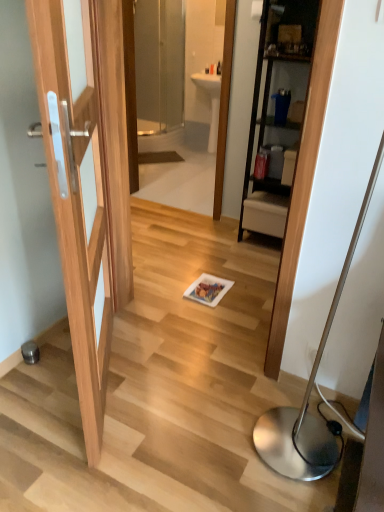
Question: Is silver metallic floor lamp at lower right taller or shorter than transparent glass mirror at upper center?

Choices:
 (A) tall
 (B) short

Answer: (B)

Question: From the image's perspective, relative to transparent glass mirror at upper center, is silver metallic floor lamp at lower right above or below?

Choices:
 (A) below
 (B) above

Answer: (A)

Question: Considering the real-world distances, which object is farthest from the silver metallic floor lamp at lower right?

Choices:
 (A) transparent glass mirror at upper center
 (B) white glossy sink at center
 (C) transparent glass screen door at upper center

Answer: (C)

Question: Based on their relative distances, which object is farther from the transparent glass screen door at upper center?

Choices:
 (A) silver metallic floor lamp at lower right
 (B) white glossy sink at center
 (C) transparent glass mirror at upper center

Answer: (A)